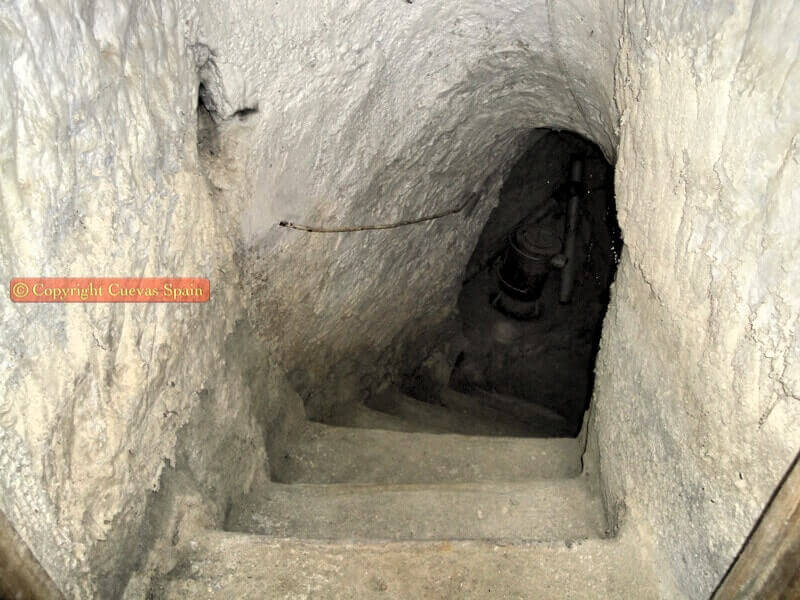
Where is `door frame`? The height and width of the screenshot is (600, 800). door frame is located at coordinates (x=770, y=575), (x=29, y=578).